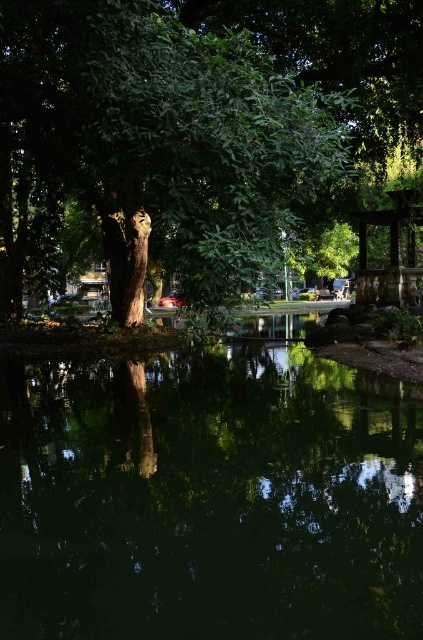
Who is more distant from viewer, (162, 636) or (406, 237)?

The point (406, 237) is more distant.

Is green reflective water at center to the right of wooden gazebo at right from the viewer's perspective?

Incorrect, green reflective water at center is not on the right side of wooden gazebo at right.

Who is more forward, (266, 438) or (392, 259)?

Point (266, 438) is more forward.

Where is `green reflective water at center`? The width and height of the screenshot is (423, 640). green reflective water at center is located at coordinates (209, 497).

Between green leafy tree at center and wooden gazebo at right, which one appears on the left side from the viewer's perspective?

Positioned to the left is green leafy tree at center.

Is green leafy tree at center closer to the viewer compared to wooden gazebo at right?

Yes.

Is point (58, 104) farther from camera compared to point (384, 280)?

That is False.

Locate an element on the screen. green leafy tree at center is located at coordinates (192, 125).

Does green reflective water at center have a lesser height compared to green leafy tree at center?

Yes.

Can you confirm if green reflective water at center is wider than green leafy tree at center?

In fact, green reflective water at center might be narrower than green leafy tree at center.

Where is `green reflective water at center`? The width and height of the screenshot is (423, 640). green reflective water at center is located at coordinates (209, 497).